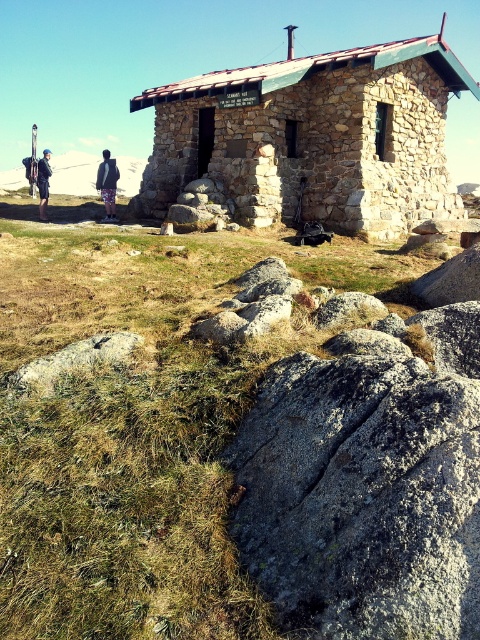
Question: Is gray rough boulder at lower left above matte black skis at left?

Choices:
 (A) yes
 (B) no

Answer: (B)

Question: Which point appears closest to the camera in this image?

Choices:
 (A) (99, 176)
 (B) (376, 77)

Answer: (B)

Question: Can you confirm if matte black skis at left is bigger than printed fabric pants at center?

Choices:
 (A) no
 (B) yes

Answer: (B)

Question: Is gray rough boulder at lower left wider than matte black skis at left?

Choices:
 (A) yes
 (B) no

Answer: (B)

Question: Which is nearer to the stone cabin at center?

Choices:
 (A) gray rough boulder at lower left
 (B) matte black skis at left

Answer: (A)

Question: Which of the following is the farthest from the observer?

Choices:
 (A) gray rough boulder at lower left
 (B) printed fabric pants at center
 (C) stone cabin at center
 (D) matte black skis at left

Answer: (D)